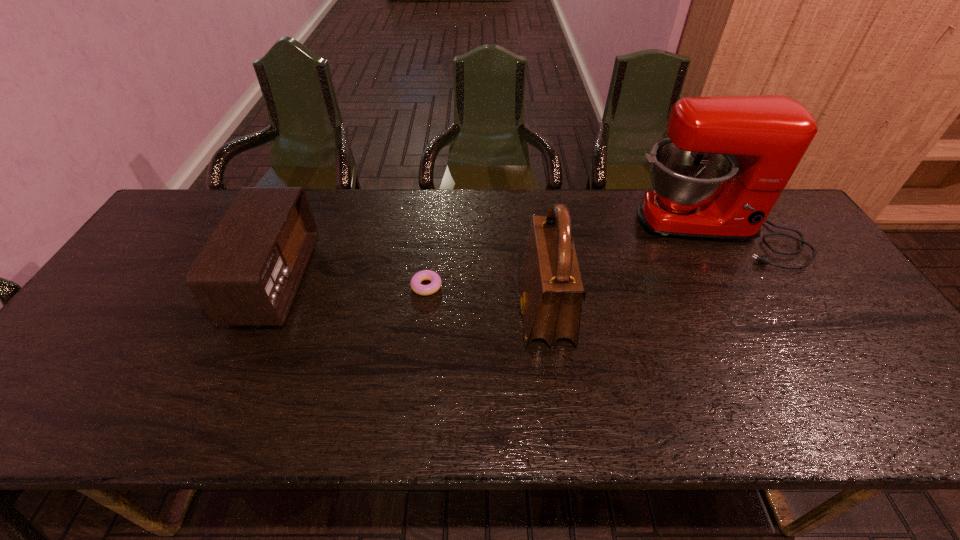
Find the location of a particular element. the rightmost object is located at coordinates (727, 160).

Identify the location of kitchen mixer. (727, 160).

The image size is (960, 540). What are the coordinates of `the third object from left to right` in the screenshot? It's located at (551, 285).

Image resolution: width=960 pixels, height=540 pixels. Find the location of `shoulder bag`. shoulder bag is located at coordinates click(551, 285).

Where is `radio receiver`? The height and width of the screenshot is (540, 960). radio receiver is located at coordinates (247, 274).

At what (x,y) coordinates should I click in order to perform the action: click on the leftmost object. Please return your answer as a coordinate pair (x, y). Looking at the image, I should click on (247, 274).

Where is `the shortest object`? the shortest object is located at coordinates (415, 283).

In order to click on doughnut in this screenshot , I will do `click(415, 283)`.

Find the location of `free space located 0.330m on the front-facing side of the rightmost object`. free space located 0.330m on the front-facing side of the rightmost object is located at coordinates (794, 376).

The height and width of the screenshot is (540, 960). I want to click on vacant region located on the front flap of the shoulder bag, so click(429, 312).